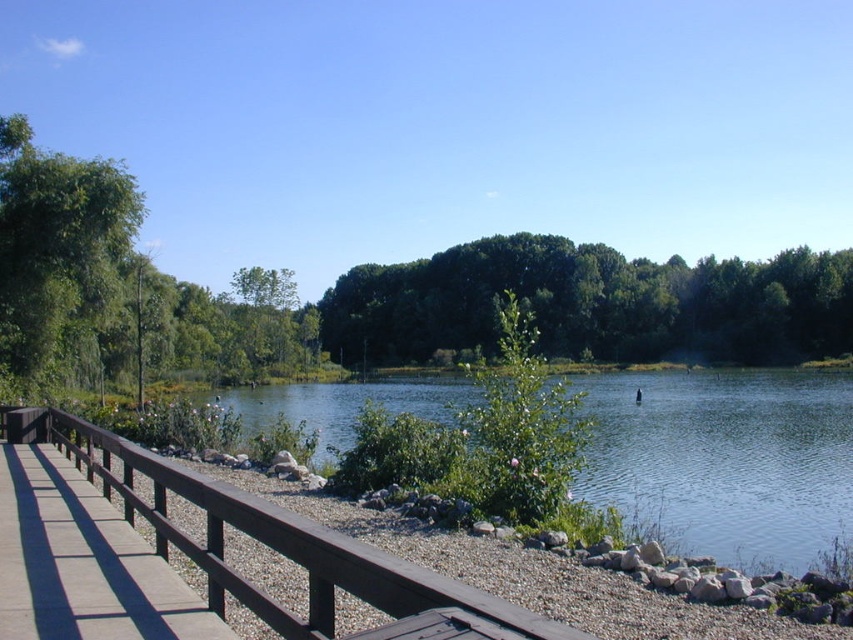
You are standing on the wooden walkway and want to cross to the other side of the lake. The brown wooden bridge at lower left is your only option. However, there is a green leafy tree at center blocking your path. Can you reach the bridge without going around the tree?

The brown wooden bridge at lower left is behind the green leafy tree at center, so you would need to go around the tree to access the bridge.

You are standing on the wooden walkway and looking towards the lake. You notice two groups of green leafy trees in the distance. Which group of trees is closer to you, the green leafy tree at center or the green leafy trees at center?

The green leafy tree at center is closer to you because it is positioned in front of the green leafy trees at center.